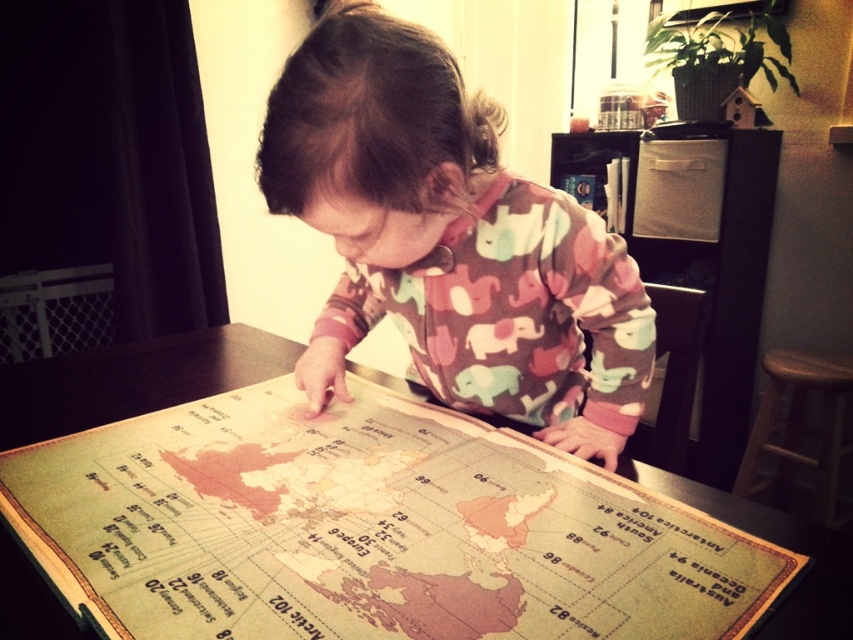
You are a photographer standing at the camera position. You need to capture a closeup shot of the vintage paper map at center. Considering your current distance, can you get a clear closeup without moving closer?

The vintage paper map at center is 17.28 inches away from camera. To capture a clear closeup, you would need to move closer or use a macro lens, as 17.28 inches might be too far for a standard lens to focus closely enough.

Consider the image. You are a photographer standing in the room and want to take a photo of the vintage paper map at center and the multicolored elephant pajamas at center. Which object will appear larger in the photo?

The vintage paper map at center will appear larger in the photo because it is closer to the viewer than the multicolored elephant pajamas at center.